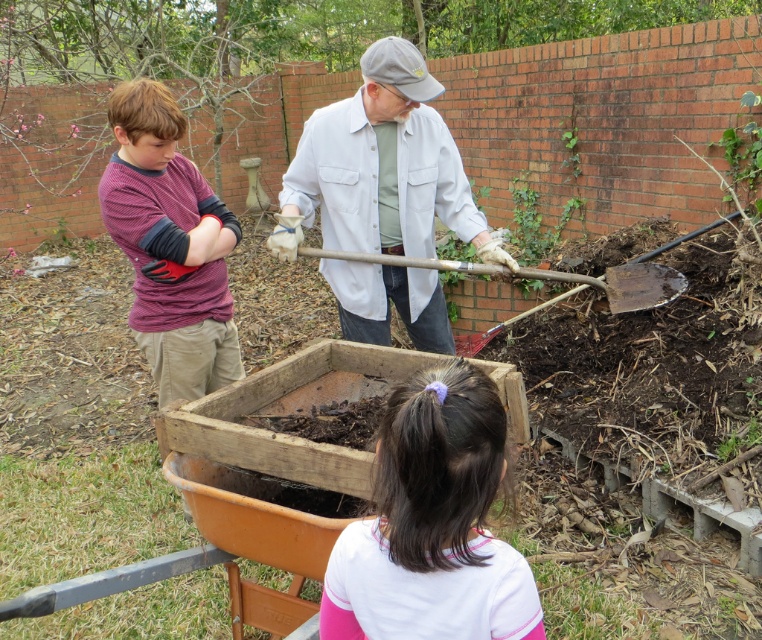
In the scene shown: You are a photographer trying to capture a closeup of the pink fabric ponytail at lower center and the white matte shirt at center. Which object will appear wider in the photo?

The white matte shirt at center will appear wider in the photo because its width is greater than the pink fabric ponytail at lower center.

You are a photographer taking a photo of the scene. You want to ensure both the pink fabric ponytail at lower center and the striped cotton shirt at left are visible in the frame. Based on their positions, which one should you focus on first to capture both in the shot?

The striped cotton shirt at left should be focused on first because the pink fabric ponytail at lower center is positioned to the right of it, meaning adjusting the frame to include the shirt on the left will naturally include the ponytail on the right as well.

You are standing at point (424, 371) and want to walk to point (341, 193). Will you have to go through any obstacles between these two points?

Point (424, 371) is in front of point (341, 193), so you will have to walk towards the direction of point (341, 193). Since there are no obstacles mentioned between them, you can go directly.